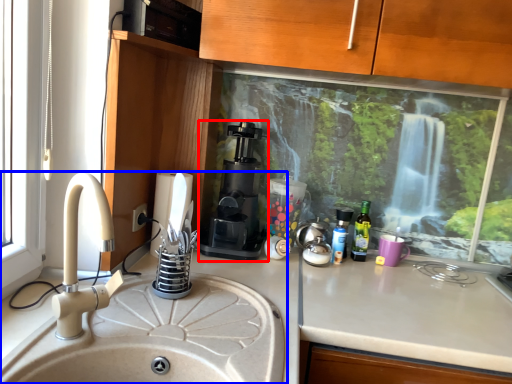
Question: Which of the following is the closest to the observer, coffee machine (highlighted by a red box) or sink (highlighted by a blue box)?

Choices:
 (A) coffee machine
 (B) sink

Answer: (B)